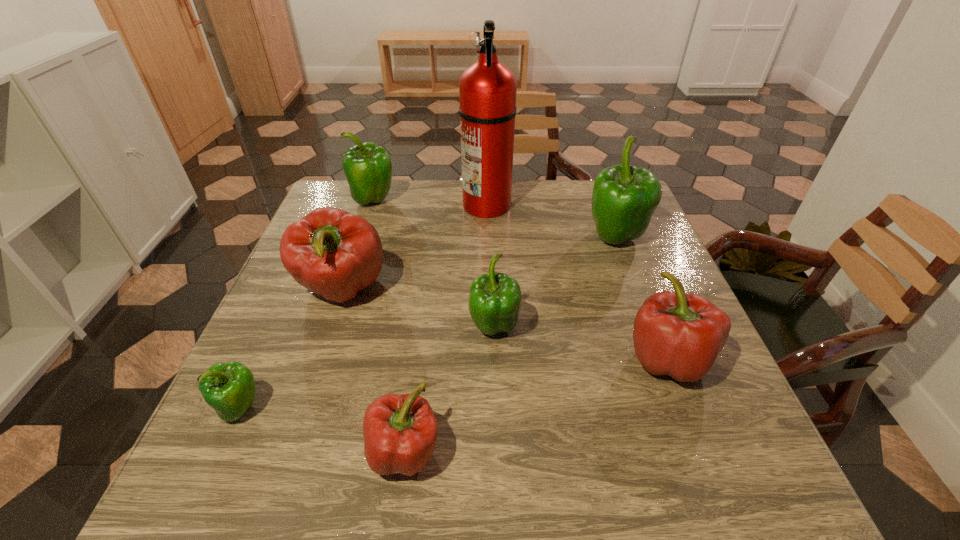
At what (x,y) coordinates should I click in order to perform the action: click on free space located 0.050m on the front of the second green bell pepper from left to right. Please return your answer as a coordinate pair (x, y). The height and width of the screenshot is (540, 960). Looking at the image, I should click on (368, 222).

This screenshot has height=540, width=960. Find the location of `vacant space located 0.120m on the front of the biggest pink bell pepper`. vacant space located 0.120m on the front of the biggest pink bell pepper is located at coordinates (316, 370).

Image resolution: width=960 pixels, height=540 pixels. What are the coordinates of `vacant area situated 0.340m on the back of the second green bell pepper from right to left` in the screenshot? It's located at (491, 223).

The height and width of the screenshot is (540, 960). I want to click on free space located 0.110m on the back of the second farthest pink bell pepper, so click(x=640, y=290).

Where is `vacant region located on the right of the nearest green bell pepper`? This screenshot has height=540, width=960. vacant region located on the right of the nearest green bell pepper is located at coordinates (300, 408).

Image resolution: width=960 pixels, height=540 pixels. I want to click on free space located on the right of the nearest pink bell pepper, so click(x=677, y=451).

What are the coordinates of `fire extinguisher at the far edge` in the screenshot? It's located at (487, 89).

This screenshot has height=540, width=960. In order to click on object that is positioned at the near edge in this screenshot , I will do (400, 431).

Identify the location of object at the far left corner. The image size is (960, 540). (368, 169).

Locate an element on the screen. This screenshot has width=960, height=540. object that is at the far right corner is located at coordinates (624, 197).